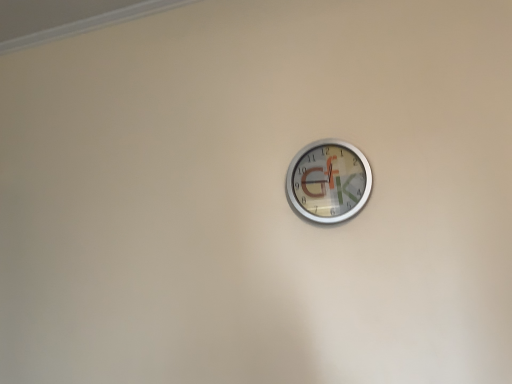
The image size is (512, 384). Identify the location of metallic silver wall clock at center. (328, 181).

Consider the image. Measure the distance between point (330, 217) and camera.

They are 4.13 feet apart.

What do you see at coordinates (328, 181) in the screenshot?
I see `metallic silver wall clock at center` at bounding box center [328, 181].

Locate an element on the screen. metallic silver wall clock at center is located at coordinates (328, 181).